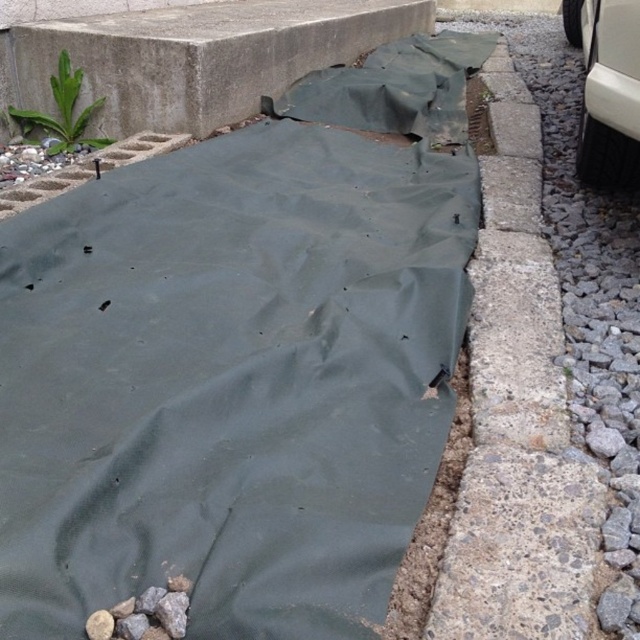
Question: Is dark green tarp at center positioned at the back of gray concrete curb at right?

Choices:
 (A) yes
 (B) no

Answer: (B)

Question: Estimate the real-world distances between objects in this image. Which object is farther from the white matte car at right?

Choices:
 (A) gray concrete curb at right
 (B) dark green tarp at center

Answer: (B)

Question: Which of the following is the farthest from the observer?

Choices:
 (A) white matte car at right
 (B) gray concrete curb at right
 (C) dark green tarp at center

Answer: (A)

Question: Does gray concrete curb at right appear over white matte car at right?

Choices:
 (A) yes
 (B) no

Answer: (B)

Question: Which object is closer to the camera taking this photo?

Choices:
 (A) white matte car at right
 (B) gray concrete curb at right
 (C) dark green tarp at center

Answer: (C)

Question: Can you confirm if dark green tarp at center is positioned to the left of gray concrete curb at right?

Choices:
 (A) yes
 (B) no

Answer: (A)